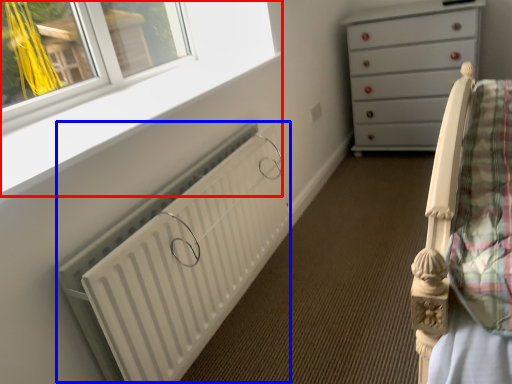
Question: Which point is further to the camera, window frame (highlighted by a red box) or radiator (highlighted by a blue box)?

Choices:
 (A) window frame
 (B) radiator

Answer: (B)